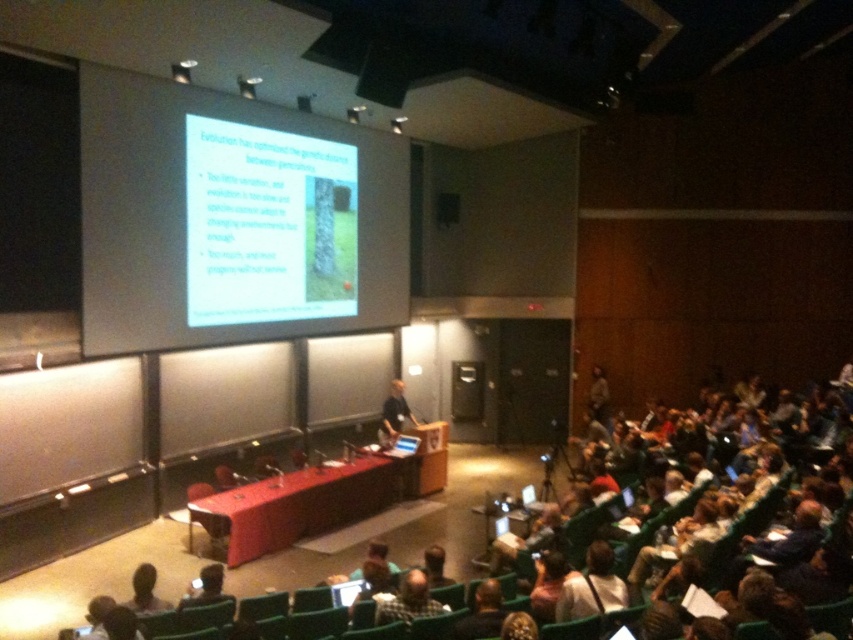
Question: Considering the relative positions of white matte projector screen at upper center and dark hair at lower left in the image provided, where is white matte projector screen at upper center located with respect to dark hair at lower left?

Choices:
 (A) right
 (B) left

Answer: (B)

Question: Is matte white projector screen at upper center to the right of black fabric shirt at center from the viewer's perspective?

Choices:
 (A) no
 (B) yes

Answer: (A)

Question: Which object appears closest to the camera in this image?

Choices:
 (A) matte black laptop at lower left
 (B) matte white projector screen at upper center
 (C) white matte projector screen at upper center

Answer: (A)

Question: Is white matte projector screen at upper center below matte black laptop at lower left?

Choices:
 (A) no
 (B) yes

Answer: (A)

Question: Among these objects, which one is nearest to the camera?

Choices:
 (A) matte black laptop at lower left
 (B) dark hair at lower left

Answer: (B)

Question: Which object is positioned closest to the matte white projector screen at upper center?

Choices:
 (A) dark hair at lower left
 (B) black fabric shirt at center
 (C) matte black laptop at lower left
 (D) white matte projector screen at upper center

Answer: (D)